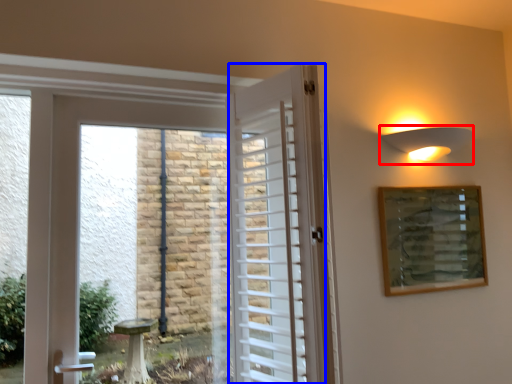
Question: Which object appears closest to the camera in this image, light fixture (highlighted by a red box) or door (highlighted by a blue box)?

Choices:
 (A) light fixture
 (B) door

Answer: (B)